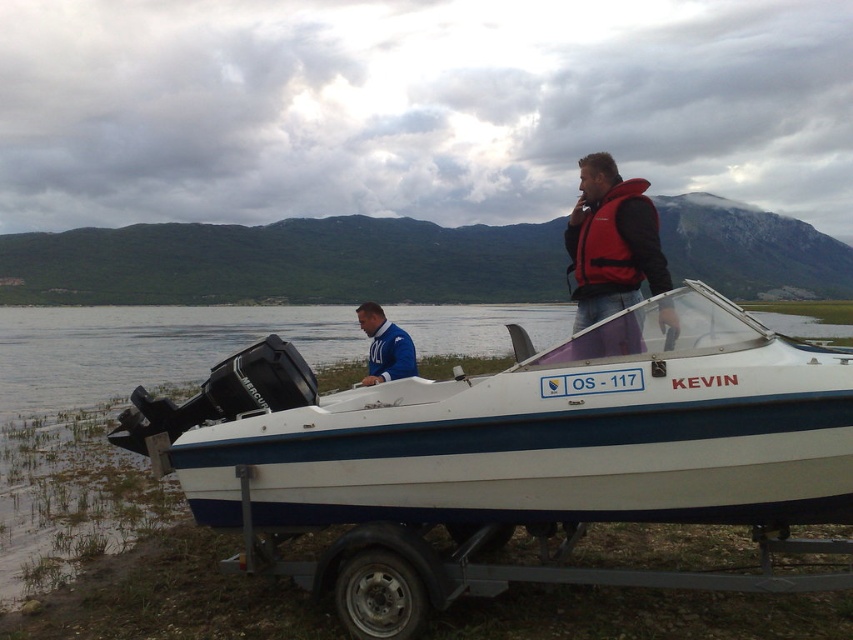
Does white glossy boat at center appear under red life vest at upper center?

Indeed, white glossy boat at center is positioned under red life vest at upper center.

Can you confirm if white glossy boat at center is positioned to the left of red life vest at upper center?

Indeed, white glossy boat at center is positioned on the left side of red life vest at upper center.

What do you see at coordinates (529, 433) in the screenshot?
I see `white glossy boat at center` at bounding box center [529, 433].

Image resolution: width=853 pixels, height=640 pixels. I want to click on white glossy boat at center, so click(x=529, y=433).

Is red life vest at upper center wider than blue fleece jacket at center?

In fact, red life vest at upper center might be narrower than blue fleece jacket at center.

Is red life vest at upper center positioned at the back of blue fleece jacket at center?

No, it is in front of blue fleece jacket at center.

Between point (598, 163) and point (368, 332), which one is positioned in front?

Positioned in front is point (598, 163).

In order to click on red life vest at upper center in this screenshot , I will do `click(611, 241)`.

Is white glossy boat at center above blue fleece jacket at center?

No.

Does white glossy boat at center have a greater height compared to blue fleece jacket at center?

In fact, white glossy boat at center may be shorter than blue fleece jacket at center.

This screenshot has height=640, width=853. What are the coordinates of `white glossy boat at center` in the screenshot? It's located at (529, 433).